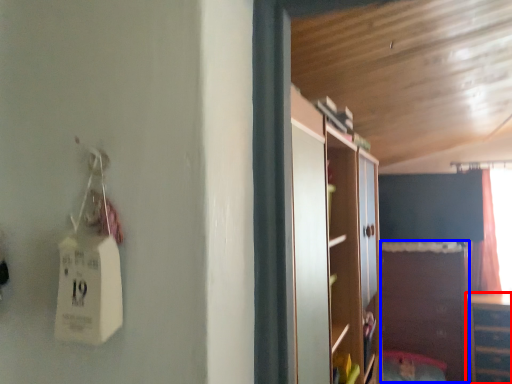
Question: Which object is further to the camera taking this photo, cabinetry (highlighted by a red box) or cabinetry (highlighted by a blue box)?

Choices:
 (A) cabinetry
 (B) cabinetry

Answer: (B)